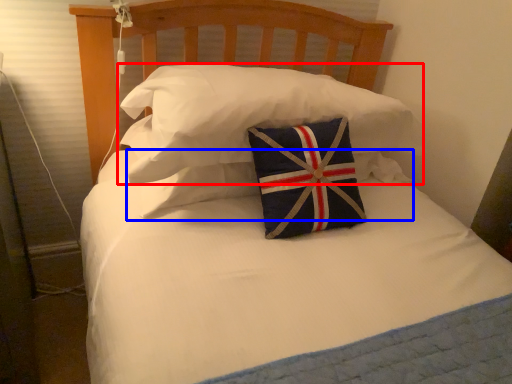
Question: Which object appears closest to the camera in this image, pillow (highlighted by a red box) or pillow (highlighted by a blue box)?

Choices:
 (A) pillow
 (B) pillow

Answer: (A)